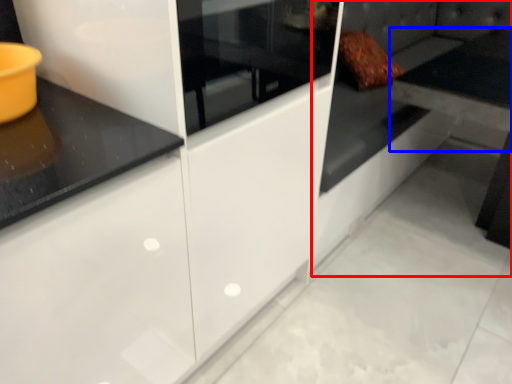
Question: Which object appears closest to the camera in this image, couch (highlighted by a red box) or table (highlighted by a blue box)?

Choices:
 (A) couch
 (B) table

Answer: (A)